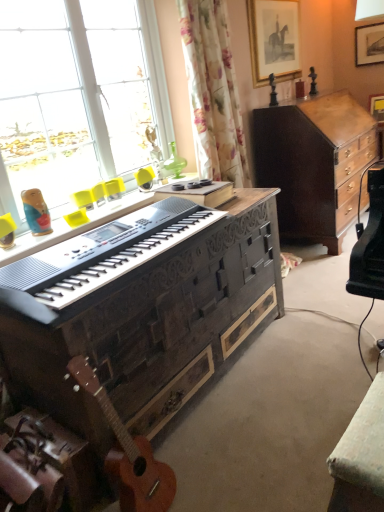
Question: Can you confirm if transparent glass window at upper left is positioned to the right of wooden framed picture at upper right, which is the 1th picture frame from front to back?

Choices:
 (A) yes
 (B) no

Answer: (B)

Question: Is transparent glass window at upper left positioned before wooden framed picture at upper right, which is the 1th picture frame from front to back?

Choices:
 (A) yes
 (B) no

Answer: (A)

Question: Can you confirm if transparent glass window at upper left is positioned to the left of wooden framed picture at upper right, which is the 1th picture frame from front to back?

Choices:
 (A) yes
 (B) no

Answer: (A)

Question: Is transparent glass window at upper left bigger than wooden framed picture at upper right, marked as the 1th picture frame in a left-to-right arrangement?

Choices:
 (A) no
 (B) yes

Answer: (B)

Question: Is transparent glass window at upper left further to the viewer compared to wooden framed picture at upper right, marked as the 1th picture frame in a left-to-right arrangement?

Choices:
 (A) yes
 (B) no

Answer: (B)

Question: From a real-world perspective, does transparent glass window at upper left sit lower than wooden framed picture at upper right, marked as the 1th picture frame in a left-to-right arrangement?

Choices:
 (A) no
 (B) yes

Answer: (B)

Question: Is dark wood cabinet at center right in front of woodendesk at center?

Choices:
 (A) no
 (B) yes

Answer: (A)

Question: Is dark wood cabinet at center right positioned with its back to woodendesk at center?

Choices:
 (A) yes
 (B) no

Answer: (B)

Question: Is dark wood cabinet at center right at the left side of woodendesk at center?

Choices:
 (A) yes
 (B) no

Answer: (B)

Question: Is dark wood cabinet at center right positioned behind woodendesk at center?

Choices:
 (A) no
 (B) yes

Answer: (B)

Question: From the image's perspective, does dark wood cabinet at center right appear higher than woodendesk at center?

Choices:
 (A) yes
 (B) no

Answer: (A)

Question: Is dark wood cabinet at center right located outside woodendesk at center?

Choices:
 (A) yes
 (B) no

Answer: (A)

Question: Would you say black textured piano at center contains orange wood guitar at lower left?

Choices:
 (A) no
 (B) yes

Answer: (A)